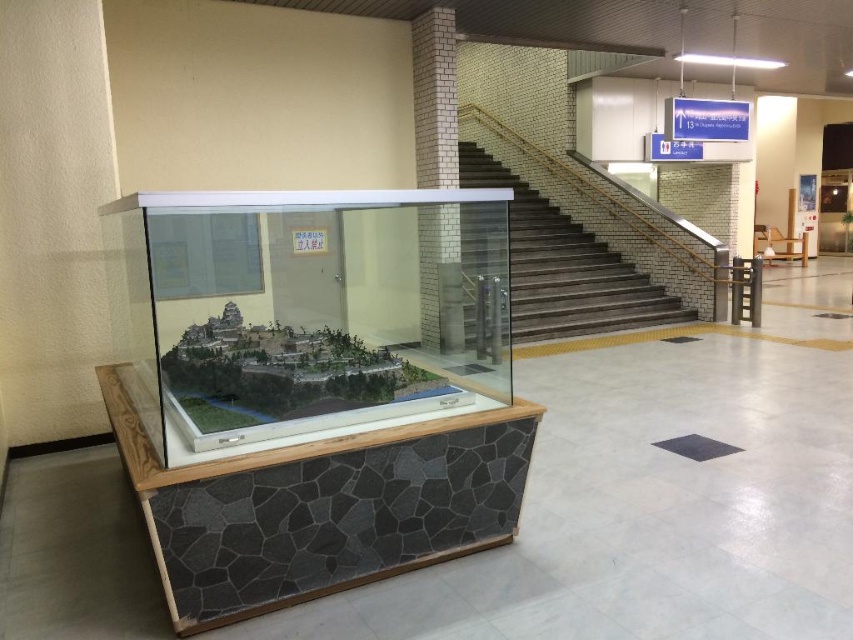
You are standing at the bottom of the staircase to the right of the clear acrylic display case at center. You want to walk to the display case. How many steps will you need to take to reach it?

The clear acrylic display case at center is 6.51 meters away from the staircase. Assuming each step is about 0.75 meters, you would need to take approximately 9 steps to reach it.

You are a delivery person carrying a package that is 1 meter wide. You need to move through the space between the clear acrylic display case at center and the dark brown wooden stairs at upper right. Can you pass through without tilting the package?

The clear acrylic display case at center is thinner than the dark brown wooden stairs at upper right, so the space between them is wider than the package. Therefore, you can pass through without tilting the package.

You are a maintenance worker who needs to clean the area between the clear acrylic display case at center and the dark brown wooden stairs at upper right. The cleaning equipment you have is 1.5 meters long. Can you move the equipment horizontally through that space without tilting it?

The distance between the clear acrylic display case at center and the dark brown wooden stairs at upper right is 6.09 meters. Since the equipment is only 1.5 meters long, it can easily be moved horizontally through the space without tilting.